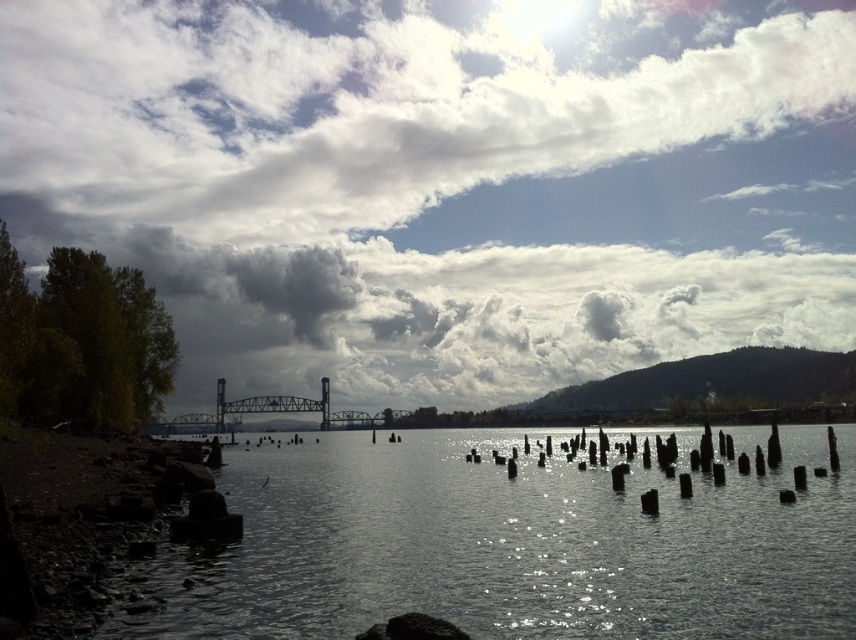
Who is higher up, cloudy sky at center or dark gray water at center?

cloudy sky at center is above.

How far apart are cloudy sky at center and dark gray water at center?

cloudy sky at center is 147.98 meters away from dark gray water at center.

Does point (847, 92) lie in front of point (669, 500)?

That is False.

Identify the location of cloudy sky at center. (443, 180).

Is point (842, 540) farther from viewer compared to point (324, 422)?

No, it is not.

Can you confirm if dark gray water at center is thinner than black metal pole at center?

No.

Locate an element on the screen. dark gray water at center is located at coordinates (508, 547).

Where is `dark gray water at center`? The height and width of the screenshot is (640, 856). dark gray water at center is located at coordinates (508, 547).

Which is more to the right, cloudy sky at center or black metal pole at center?

From the viewer's perspective, cloudy sky at center appears more on the right side.

Can you confirm if cloudy sky at center is smaller than black metal pole at center?

No, cloudy sky at center is not smaller than black metal pole at center.

Between point (679, 17) and point (325, 422), which one is positioned in front?

Point (325, 422) is in front.

Where is `cloudy sky at center`? cloudy sky at center is located at coordinates (443, 180).